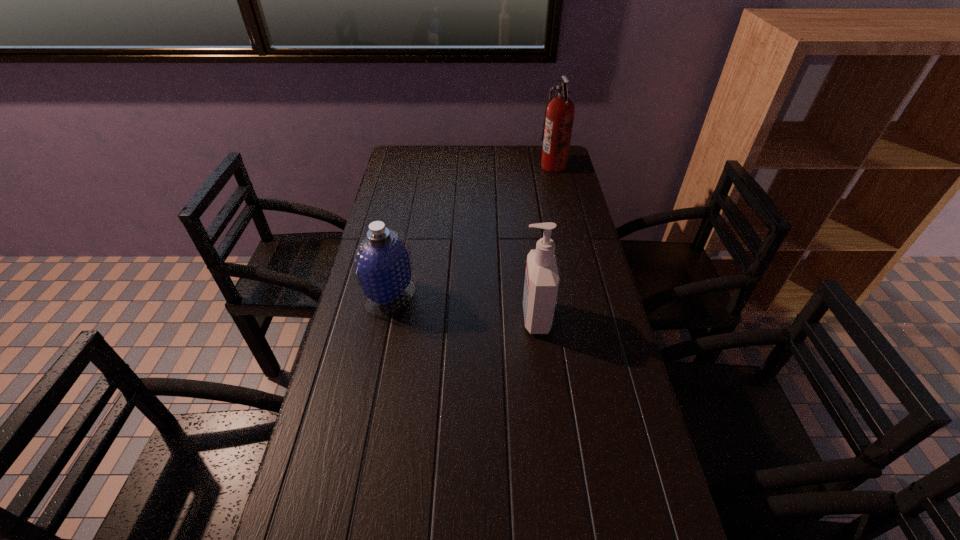
Locate an element on the screen. Image resolution: width=960 pixels, height=540 pixels. the rightmost object is located at coordinates (559, 115).

Identify the location of the farthest object. The image size is (960, 540). (559, 115).

The height and width of the screenshot is (540, 960). In order to click on the taller cleansing agent in this screenshot , I will do `click(541, 284)`.

Locate an element on the screen. This screenshot has width=960, height=540. the right cleansing agent is located at coordinates (541, 284).

This screenshot has height=540, width=960. I want to click on the leftmost object, so click(383, 264).

In order to click on the shorter cleansing agent in this screenshot , I will do `click(383, 264)`.

Find the location of a particular element. This screenshot has height=540, width=960. vacant area located on the front of the farthest object near the operation label is located at coordinates (490, 166).

At what (x,y) coordinates should I click in order to perform the action: click on free space located 0.380m on the front of the farthest object near the operation label. Please return your answer as a coordinate pair (x, y). The image size is (960, 540). Looking at the image, I should click on (448, 166).

The height and width of the screenshot is (540, 960). In order to click on vacant space situated 0.400m on the front of the farthest object near the operation label in this screenshot , I will do `click(444, 166)`.

At what (x,y) coordinates should I click in order to perform the action: click on free spot located on the front label of the second object from left to right. Please return your answer as a coordinate pair (x, y). This screenshot has height=540, width=960. Looking at the image, I should click on (498, 318).